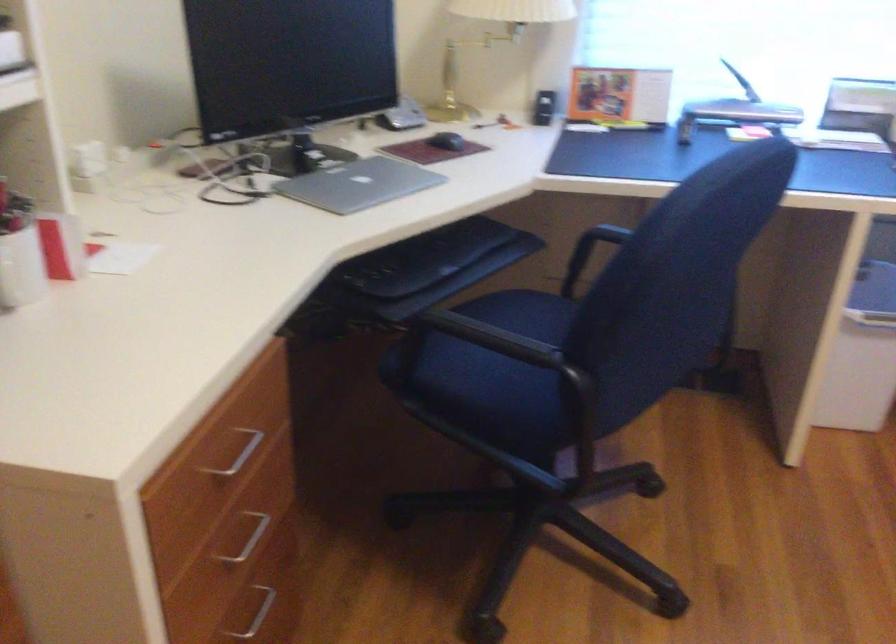
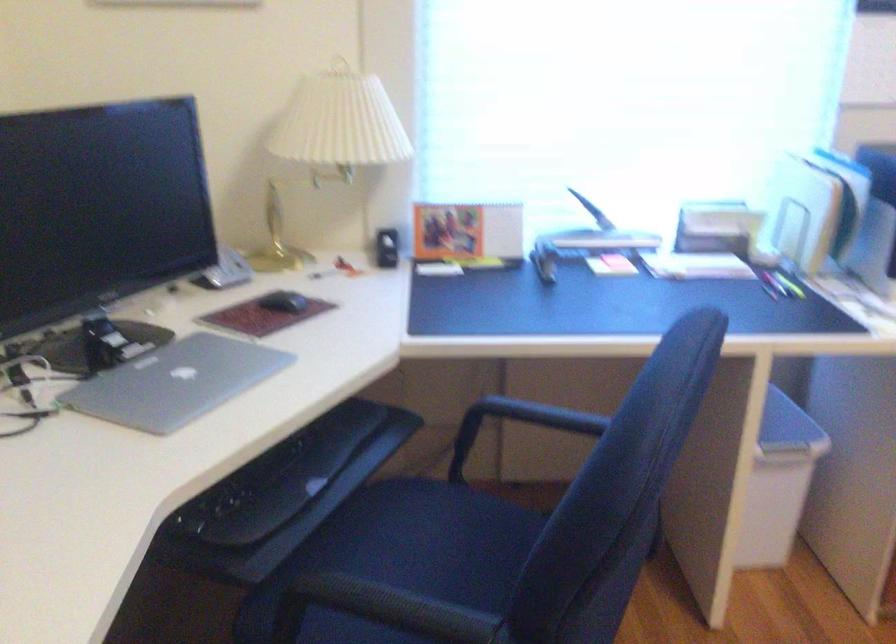
Question: How did the camera likely rotate?

Choices:
 (A) Left
 (B) Right
 (C) Up
 (D) Down

Answer: (B)